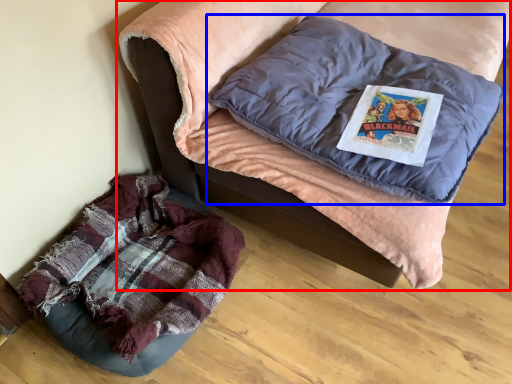
Question: Which point is further to the camera, furniture (highlighted by a red box) or pillow (highlighted by a blue box)?

Choices:
 (A) furniture
 (B) pillow

Answer: (B)